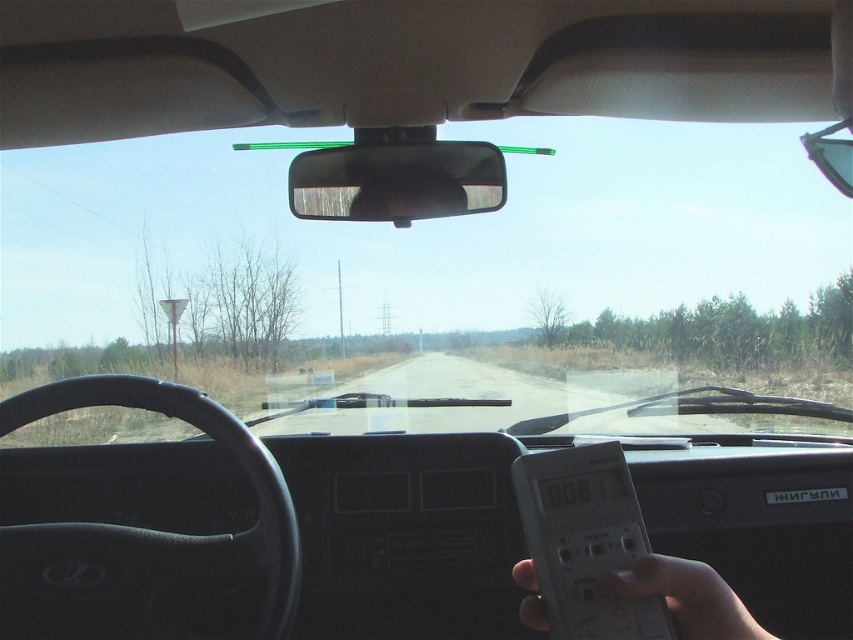
Is the position of black glossy view mirror at center more distant than that of white plastic remote at lower right?

Yes.

Where is `black glossy view mirror at center`? black glossy view mirror at center is located at coordinates (397, 180).

I want to click on white plastic remote at right, so click(x=585, y=541).

Can you confirm if white plastic remote at right is positioned above black glossy view mirror at center?

No.

Locate an element on the screen. The image size is (853, 640). white plastic remote at right is located at coordinates (585, 541).

Which is more to the right, white plastic remote at right or white plastic remote at lower right?

Positioned to the right is white plastic remote at lower right.

Is white plastic remote at right to the left of white plastic remote at lower right from the viewer's perspective?

Correct, you'll find white plastic remote at right to the left of white plastic remote at lower right.

What do you see at coordinates (585, 541) in the screenshot?
I see `white plastic remote at right` at bounding box center [585, 541].

This screenshot has width=853, height=640. In order to click on white plastic remote at right in this screenshot , I will do `click(585, 541)`.